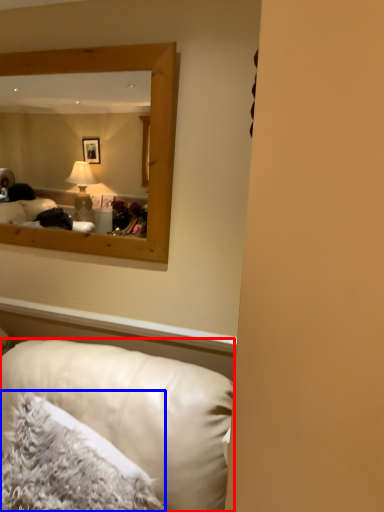
Question: Which point is closer to the camera, studio couch (highlighted by a red box) or pillow (highlighted by a blue box)?

Choices:
 (A) studio couch
 (B) pillow

Answer: (A)